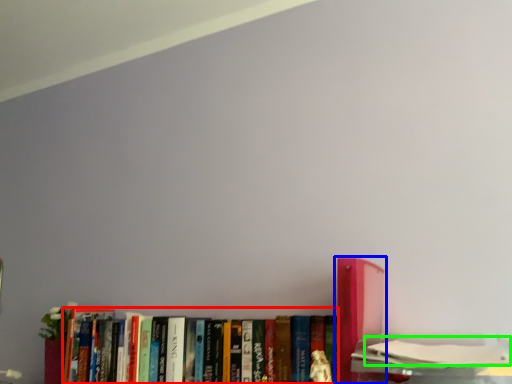
Question: Considering the real-world distances, which object is farthest from book (highlighted by a red box)? book (highlighted by a blue box) or book (highlighted by a green box)?

Choices:
 (A) book
 (B) book

Answer: (B)